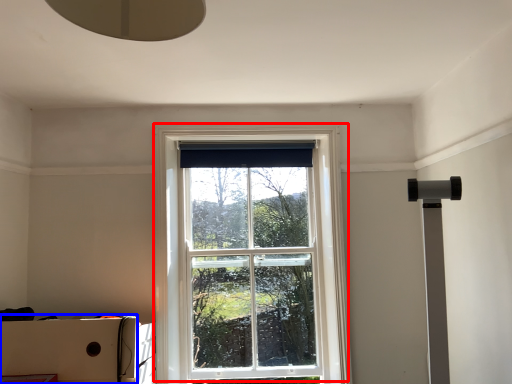
Question: Among these objects, which one is nearest to the camera, window (highlighted by a red box) or cardboard box (highlighted by a blue box)?

Choices:
 (A) window
 (B) cardboard box

Answer: (B)